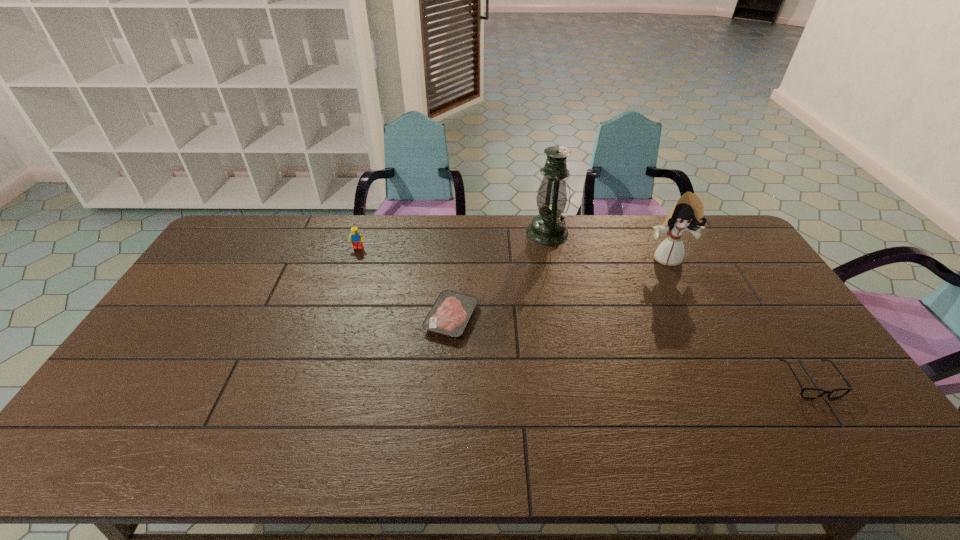
Where is `the third object from left to right`? the third object from left to right is located at coordinates (548, 228).

I want to click on the tallest object, so click(x=548, y=228).

Find the location of a particular element. The height and width of the screenshot is (540, 960). doll is located at coordinates (687, 214).

The image size is (960, 540). I want to click on the fourth object from left to right, so click(687, 214).

I want to click on Lego, so click(x=356, y=238).

Find the location of a particular element. The image size is (960, 540). the leftmost object is located at coordinates click(x=356, y=238).

Where is `the second shortest object`? The height and width of the screenshot is (540, 960). the second shortest object is located at coordinates (810, 393).

This screenshot has height=540, width=960. Find the location of `the nearest object`. the nearest object is located at coordinates (810, 393).

Identify the location of the fourth farthest object. This screenshot has width=960, height=540. (451, 312).

Where is `steak`? The height and width of the screenshot is (540, 960). steak is located at coordinates (451, 312).